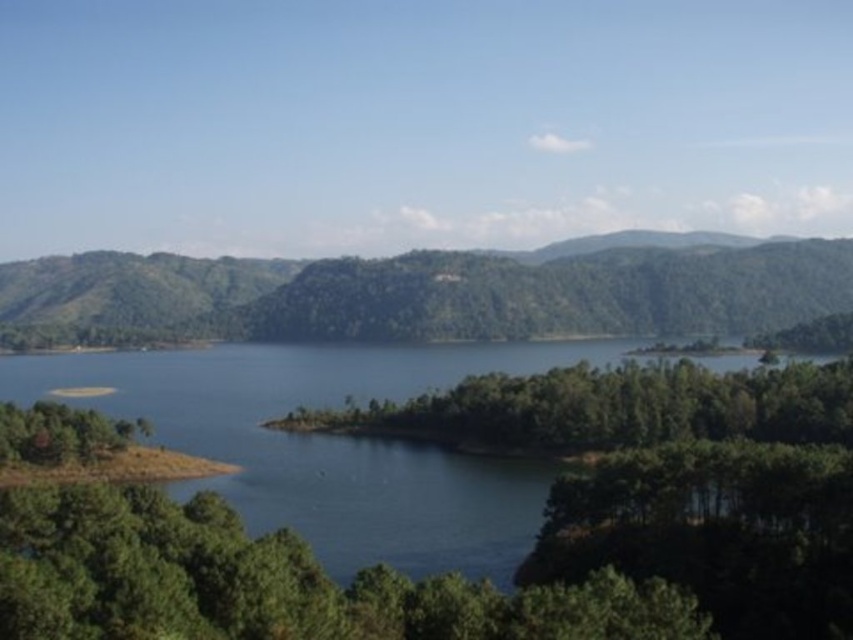
Is the position of blue liquid water at center less distant than that of green forested mountain at center?

That is True.

From the picture: Does blue liquid water at center come behind green forested mountain at center?

No, it is not.

Where is `blue liquid water at center`? Image resolution: width=853 pixels, height=640 pixels. blue liquid water at center is located at coordinates (329, 444).

Where is `blue liquid water at center`? The height and width of the screenshot is (640, 853). blue liquid water at center is located at coordinates (329, 444).